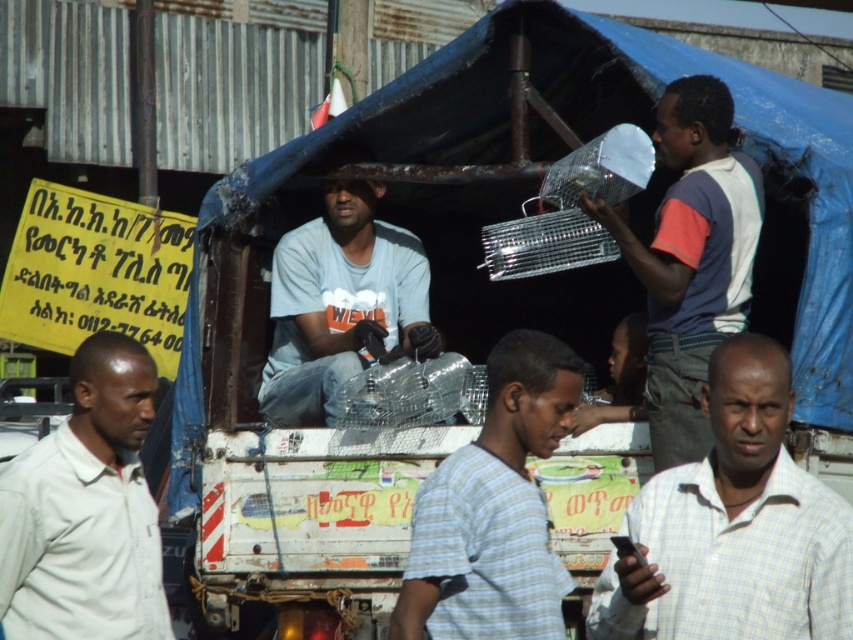
Question: Which point appears closest to the camera in this image?

Choices:
 (A) (679, 371)
 (B) (27, 602)
 (C) (637, 349)
 (D) (727, 492)

Answer: (D)

Question: Which object is the closest to the light blue striped shirt at center?

Choices:
 (A) white plastic bag at upper right
 (B) white checkered shirt at center
 (C) white matte shirt at left

Answer: (B)

Question: Is light blue striped shirt at center below white plastic bag at upper right?

Choices:
 (A) no
 (B) yes

Answer: (B)

Question: Is white plastic bag at upper right thinner than matte gray shirt at center?

Choices:
 (A) no
 (B) yes

Answer: (B)

Question: Among these objects, which one is nearest to the camera?

Choices:
 (A) white matte shirt at left
 (B) white plastic bag at upper right
 (C) light blue striped shirt at center
 (D) smooth skin face at center

Answer: (C)

Question: Does white checkered shirt at center appear under white matte shirt at left?

Choices:
 (A) yes
 (B) no

Answer: (B)